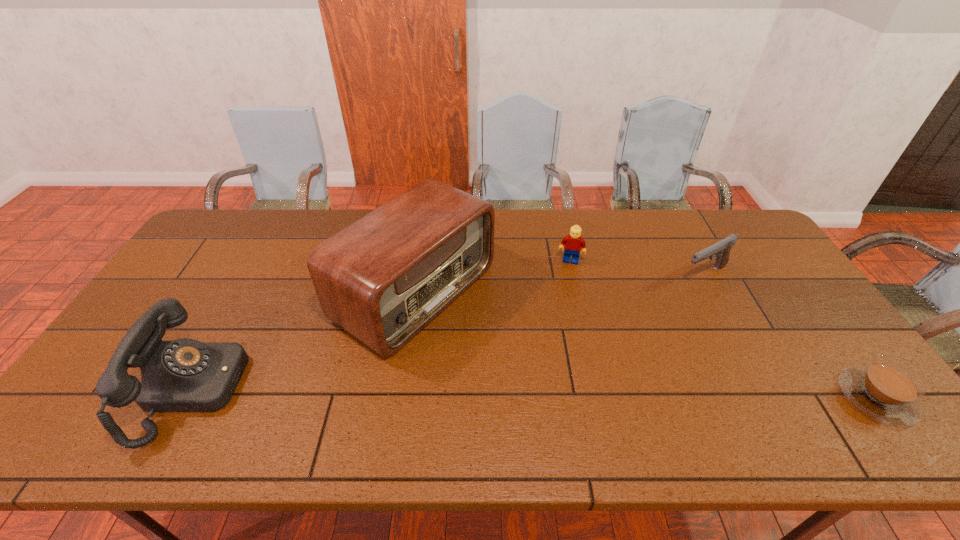
Find the location of a particular element. vacant space on the desktop that is between the second tallest object and the cappuccino and is positioned on the front panel of the second object from left to right is located at coordinates (591, 394).

The image size is (960, 540). Find the location of `vacant space on the desktop that is between the telephone and the shortest object and is positioned on the front-facing side of the Lego`. vacant space on the desktop that is between the telephone and the shortest object and is positioned on the front-facing side of the Lego is located at coordinates (547, 393).

Identify the location of vacant spot on the desktop that is between the fourth shortest object and the cappuccino and is positioned at the barrel of the pistol. Image resolution: width=960 pixels, height=540 pixels. (492, 393).